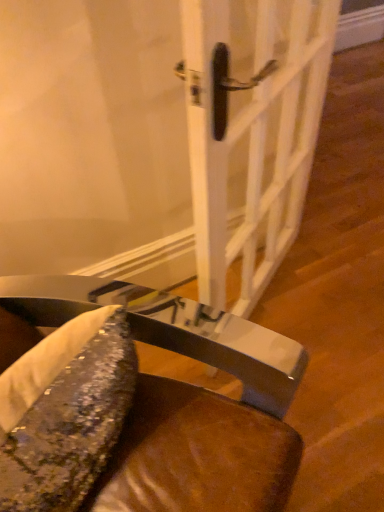
Find the location of a particular element. Image resolution: width=384 pixels, height=512 pixels. white glossy door handle at center is located at coordinates (253, 132).

Locate an element on the screen. white glossy door handle at center is located at coordinates (253, 132).

Is shiny metallic fish at lower left at the right side of white glossy door handle at center?

Incorrect, shiny metallic fish at lower left is not on the right side of white glossy door handle at center.

From the picture: Is shiny metallic fish at lower left oriented towards white glossy door handle at center?

No, shiny metallic fish at lower left is not oriented towards white glossy door handle at center.

From a real-world perspective, between shiny metallic fish at lower left and white glossy door handle at center, who is vertically lower?

In real-world perspective, shiny metallic fish at lower left is lower.

From a real-world perspective, which object stands above the other?

From a 3D spatial view, shiny metallic fish at lower left is above.

Measure the distance from shiny metallic fish at lower left to metallic sequined cushion at lower center.

shiny metallic fish at lower left is 13.02 centimeters from metallic sequined cushion at lower center.

Is shiny metallic fish at lower left oriented towards metallic sequined cushion at lower center?

Yes, shiny metallic fish at lower left is facing metallic sequined cushion at lower center.

Who is smaller, shiny metallic fish at lower left or metallic sequined cushion at lower center?

Smaller between the two is shiny metallic fish at lower left.

From the image's perspective, between metallic sequined cushion at lower center and shiny metallic fish at lower left, which one is located above?

shiny metallic fish at lower left appears higher in the image.

Between metallic sequined cushion at lower center and shiny metallic fish at lower left, which one has smaller width?

With smaller width is shiny metallic fish at lower left.

Is metallic sequined cushion at lower center to the left of shiny metallic fish at lower left from the viewer's perspective?

Incorrect, metallic sequined cushion at lower center is not on the left side of shiny metallic fish at lower left.

You are a GUI agent. You are given a task and a screenshot of the screen. Output one action in this format:
    pyautogui.click(x=<x>, y=<y>)
    Task: Click on the chair that appears in front of the white glossy door handle at center
    This screenshot has width=384, height=512.
    Given the screenshot: What is the action you would take?
    pyautogui.click(x=186, y=401)

From a real-world perspective, who is located higher, white glossy door handle at center or metallic sequined cushion at lower center?

white glossy door handle at center is physically above.

Can you confirm if white glossy door handle at center is wider than metallic sequined cushion at lower center?

Incorrect, the width of white glossy door handle at center does not surpass that of metallic sequined cushion at lower center.

Is white glossy door handle at center surrounded by metallic sequined cushion at lower center?

No, white glossy door handle at center is not a part of metallic sequined cushion at lower center.

This screenshot has width=384, height=512. I want to click on door lying above the metallic sequined cushion at lower center (from the image's perspective), so click(253, 132).

Is the surface of metallic sequined cushion at lower center in direct contact with white glossy door handle at center?

No, metallic sequined cushion at lower center is not next to white glossy door handle at center.

Which point is more distant from viewer, [117,477] or [184,32]?

Point [184,32]

Is white glossy door handle at center positioned with its back to shiny metallic fish at lower left?

That's not correct — white glossy door handle at center is not looking away from shiny metallic fish at lower left.

From their relative heights in the image, would you say white glossy door handle at center is taller or shorter than shiny metallic fish at lower left?

white glossy door handle at center is taller than shiny metallic fish at lower left.

Does white glossy door handle at center have a lesser width compared to shiny metallic fish at lower left?

Correct, the width of white glossy door handle at center is less than that of shiny metallic fish at lower left.

Is there a large distance between white glossy door handle at center and shiny metallic fish at lower left?

white glossy door handle at center is near shiny metallic fish at lower left, not far away.

Locate an element on the screen. The height and width of the screenshot is (512, 384). door behind the shiny metallic fish at lower left is located at coordinates (253, 132).

At what (x,y) coordinates should I click in order to perform the action: click on chair on the right of shiny metallic fish at lower left. Please return your answer as a coordinate pair (x, y). The width and height of the screenshot is (384, 512). Looking at the image, I should click on (186, 401).

From the image, which object appears to be nearer to shiny metallic fish at lower left, metallic sequined cushion at lower center or white glossy door handle at center?

metallic sequined cushion at lower center is positioned closer to the anchor shiny metallic fish at lower left.

Estimate the real-world distances between objects in this image. Which object is closer to shiny metallic fish at lower left, white glossy door handle at center or metallic sequined cushion at lower center?

The object closer to shiny metallic fish at lower left is metallic sequined cushion at lower center.

When comparing their distances from metallic sequined cushion at lower center, does shiny metallic fish at lower left or white glossy door handle at center seem closer?

shiny metallic fish at lower left.

Considering their positions, is shiny metallic fish at lower left positioned further to white glossy door handle at center than metallic sequined cushion at lower center?

The object further to white glossy door handle at center is shiny metallic fish at lower left.

Which object lies further to the anchor point white glossy door handle at center, metallic sequined cushion at lower center or shiny metallic fish at lower left?

shiny metallic fish at lower left is further to white glossy door handle at center.

When comparing their distances from metallic sequined cushion at lower center, does white glossy door handle at center or shiny metallic fish at lower left seem further?

white glossy door handle at center lies further to metallic sequined cushion at lower center than the other object.

Locate an element on the screen. This screenshot has height=512, width=384. food between white glossy door handle at center and metallic sequined cushion at lower center from top to bottom is located at coordinates (71, 426).